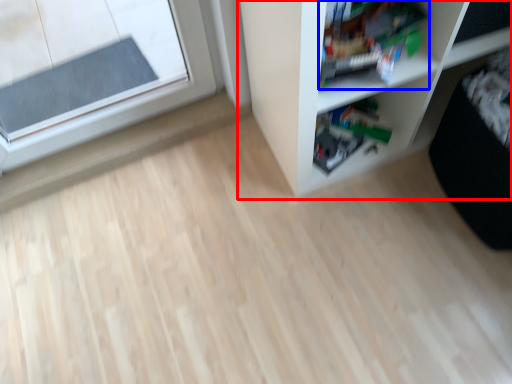
Question: Which object is closer to the camera taking this photo, shelf (highlighted by a red box) or toy (highlighted by a blue box)?

Choices:
 (A) shelf
 (B) toy

Answer: (A)